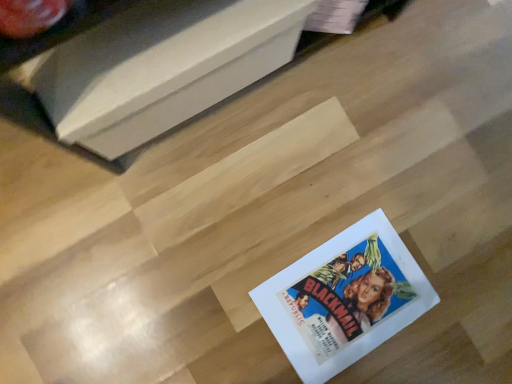
Where is `white paper at lower center`? white paper at lower center is located at coordinates (162, 67).

Describe the element at coordinates (162, 67) in the screenshot. I see `white paper at lower center` at that location.

What is the approximate width of white paper at lower center?

The width of white paper at lower center is 10.09 inches.

Find the location of a particular element. white paper at lower center is located at coordinates (162, 67).